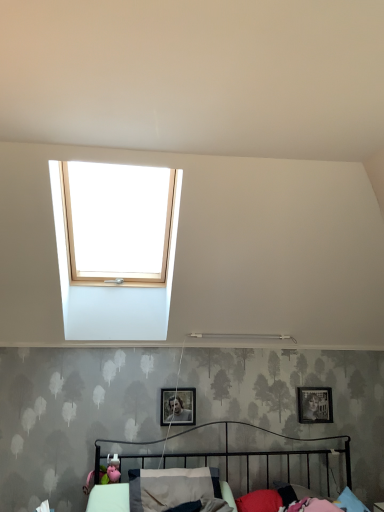
Question: Can you confirm if matte black picture frame at upper right, the second picture frame from the front, is taller than metallic black bed at lower center?

Choices:
 (A) yes
 (B) no

Answer: (B)

Question: Is matte black picture frame at upper right, the second picture frame from the front, facing away from metallic black bed at lower center?

Choices:
 (A) yes
 (B) no

Answer: (B)

Question: From the image's perspective, would you say matte black picture frame at upper right, marked as the 2th picture frame in a left-to-right arrangement, is shown under metallic black bed at lower center?

Choices:
 (A) no
 (B) yes

Answer: (A)

Question: Is matte black picture frame at upper right, arranged as the 1th picture frame when viewed from the right, touching metallic black bed at lower center?

Choices:
 (A) yes
 (B) no

Answer: (B)

Question: In the image, is metallic silver picture frame at center, the 1th picture frame viewed from the front, on the left side or the right side of matte black picture frame at upper right, arranged as the 1th picture frame when viewed from the right?

Choices:
 (A) left
 (B) right

Answer: (A)

Question: In terms of width, does metallic silver picture frame at center, the 1th picture frame viewed from the front, look wider or thinner when compared to matte black picture frame at upper right, the second picture frame from the front?

Choices:
 (A) thin
 (B) wide

Answer: (B)

Question: Does point (188, 422) appear closer or farther from the camera than point (297, 417)?

Choices:
 (A) farther
 (B) closer

Answer: (B)

Question: Is metallic silver picture frame at center, the second picture frame from the right, inside or outside of matte black picture frame at upper right, which is the 1th picture frame from back to front?

Choices:
 (A) inside
 (B) outside

Answer: (B)

Question: Is matte black picture frame at upper right, marked as the 2th picture frame in a left-to-right arrangement, to the left or to the right of metallic silver picture frame at center, the 1th picture frame viewed from the front, in the image?

Choices:
 (A) left
 (B) right

Answer: (B)

Question: From their relative heights in the image, would you say matte black picture frame at upper right, arranged as the 1th picture frame when viewed from the right, is taller or shorter than metallic silver picture frame at center, arranged as the 2th picture frame when viewed from the back?

Choices:
 (A) short
 (B) tall

Answer: (B)

Question: From a real-world perspective, is matte black picture frame at upper right, marked as the 2th picture frame in a left-to-right arrangement, physically located above or below metallic silver picture frame at center, arranged as the 2th picture frame when viewed from the back?

Choices:
 (A) below
 (B) above

Answer: (B)

Question: From the image's perspective, is matte black picture frame at upper right, the second picture frame from the front, positioned above or below metallic silver picture frame at center, marked as the first picture frame in a left-to-right arrangement?

Choices:
 (A) above
 (B) below

Answer: (B)

Question: In terms of size, does metallic black bed at lower center appear bigger or smaller than red fabric pillow at lower center, the second pillow viewed from the left?

Choices:
 (A) big
 (B) small

Answer: (A)

Question: Does point (244, 489) appear closer or farther from the camera than point (274, 508)?

Choices:
 (A) farther
 (B) closer

Answer: (A)